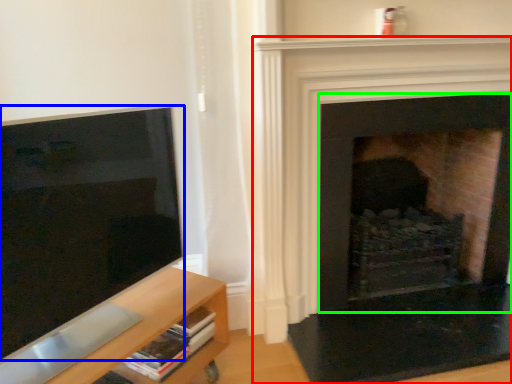
Question: Based on their relative distances, which object is nearer to fireplace (highlighted by a red box)? Choose from screen (highlighted by a blue box) and fireplace (highlighted by a green box).

Choices:
 (A) screen
 (B) fireplace

Answer: (B)